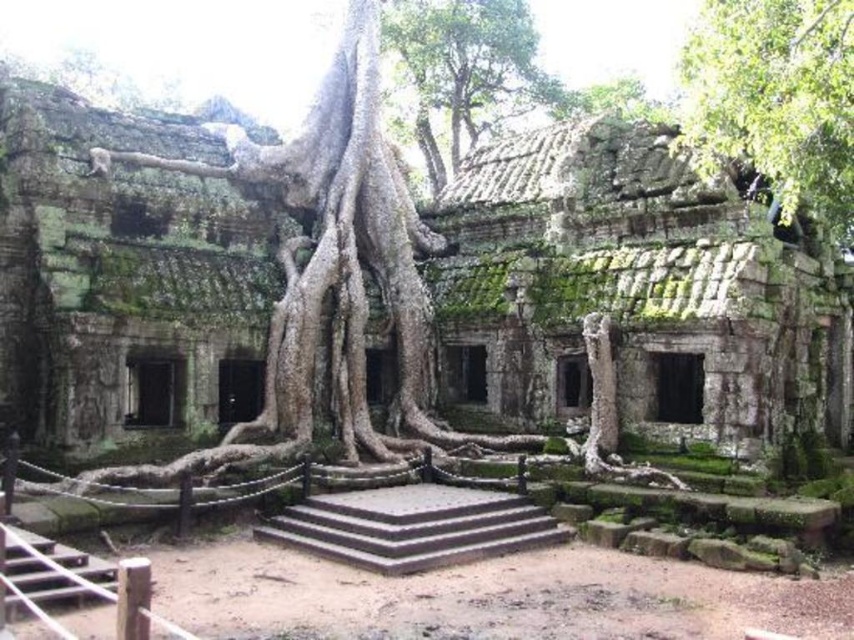
Is green leafy tree at upper right to the left of green mossy tree at upper center from the viewer's perspective?

No, green leafy tree at upper right is not to the left of green mossy tree at upper center.

Is green leafy tree at upper right taller than green mossy tree at upper center?

In fact, green leafy tree at upper right may be shorter than green mossy tree at upper center.

I want to click on green leafy tree at upper right, so coord(778,97).

Who is lower down, green mossy stone ruins at center or green mossy tree at upper center?

green mossy stone ruins at center is lower down.

Is point (34, 288) positioned after point (518, 19)?

No.

Image resolution: width=854 pixels, height=640 pixels. In order to click on green mossy stone ruins at center in this screenshot , I will do `click(589, 273)`.

Which is in front, point (10, 291) or point (809, 160)?

Point (809, 160) is in front.

Is point (589, 268) positioned after point (814, 97)?

Yes, point (589, 268) is farther from viewer.

Between point (525, 196) and point (721, 97), which one is positioned behind?

Positioned behind is point (525, 196).

Image resolution: width=854 pixels, height=640 pixels. I want to click on green mossy stone ruins at center, so click(x=589, y=273).